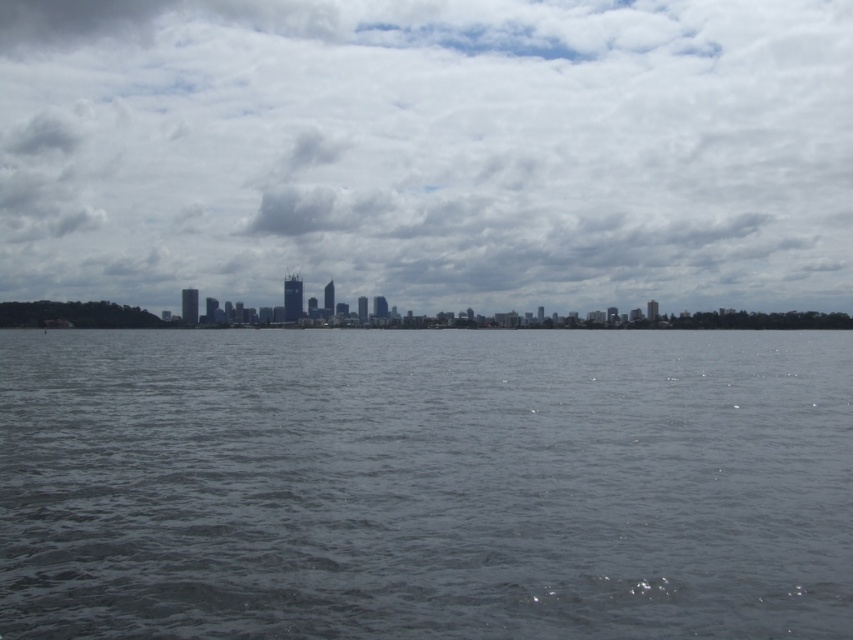
Question: Is gray water at center closer to camera compared to cloudy sky at center?

Choices:
 (A) yes
 (B) no

Answer: (A)

Question: Does gray water at center appear on the right side of cloudy sky at center?

Choices:
 (A) no
 (B) yes

Answer: (B)

Question: Among these points, which one is farthest from the camera?

Choices:
 (A) (527, 252)
 (B) (459, 600)

Answer: (A)

Question: Does gray water at center lie in front of cloudy sky at center?

Choices:
 (A) no
 (B) yes

Answer: (B)